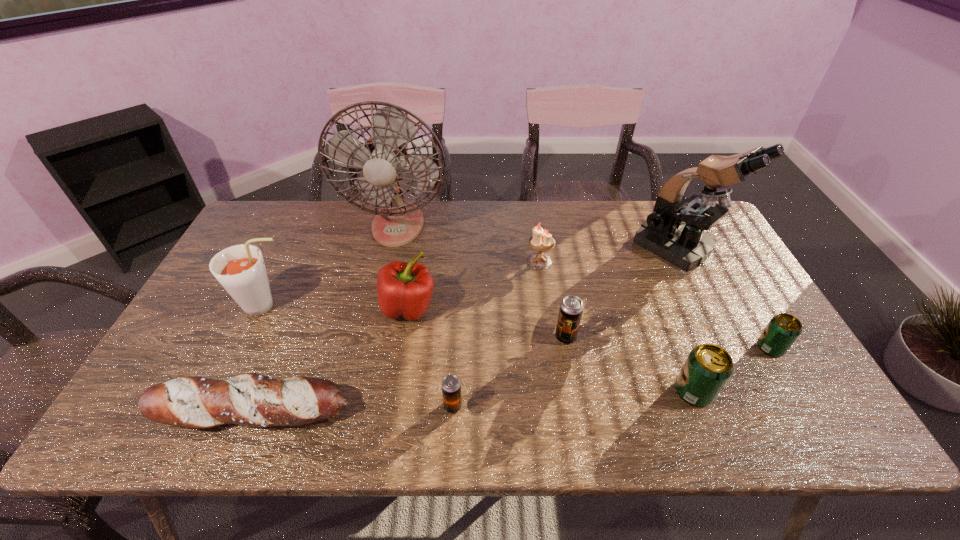
Where is `beer can that is the closest to the farther green beer can`? The width and height of the screenshot is (960, 540). beer can that is the closest to the farther green beer can is located at coordinates (708, 367).

Where is `free space that satisfies the following two spatial constraints: 1. on the drink side of the root beer; 2. on the back side of the nearer black beer can`? This screenshot has height=540, width=960. free space that satisfies the following two spatial constraints: 1. on the drink side of the root beer; 2. on the back side of the nearer black beer can is located at coordinates (219, 406).

You are a GUI agent. You are given a task and a screenshot of the screen. Output one action in this format:
    pyautogui.click(x=<x>, y=<y>)
    Task: Click on the vacant region that satisfies the following two spatial constraints: 1. on the front side of the bigger black beer can; 2. on the right side of the left green beer can
    
    Given the screenshot: What is the action you would take?
    pyautogui.click(x=575, y=392)

Where is `vacant space that satisfies the following two spatial constraints: 1. on the drink side of the eighth shortest object; 2. on the left side of the bell pepper`? The image size is (960, 540). vacant space that satisfies the following two spatial constraints: 1. on the drink side of the eighth shortest object; 2. on the left side of the bell pepper is located at coordinates (265, 307).